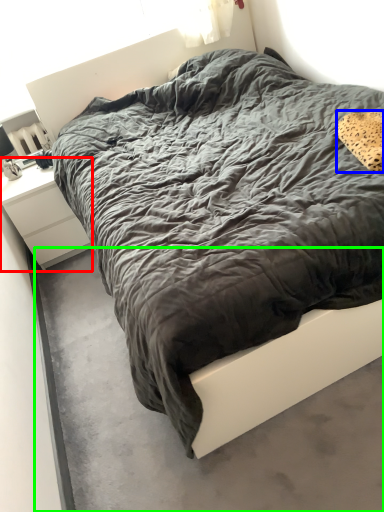
Question: Which object is positioned farthest from nightstand (highlighted by a red box)? Select from pillow (highlighted by a blue box) and concrete (highlighted by a green box).

Choices:
 (A) pillow
 (B) concrete

Answer: (A)